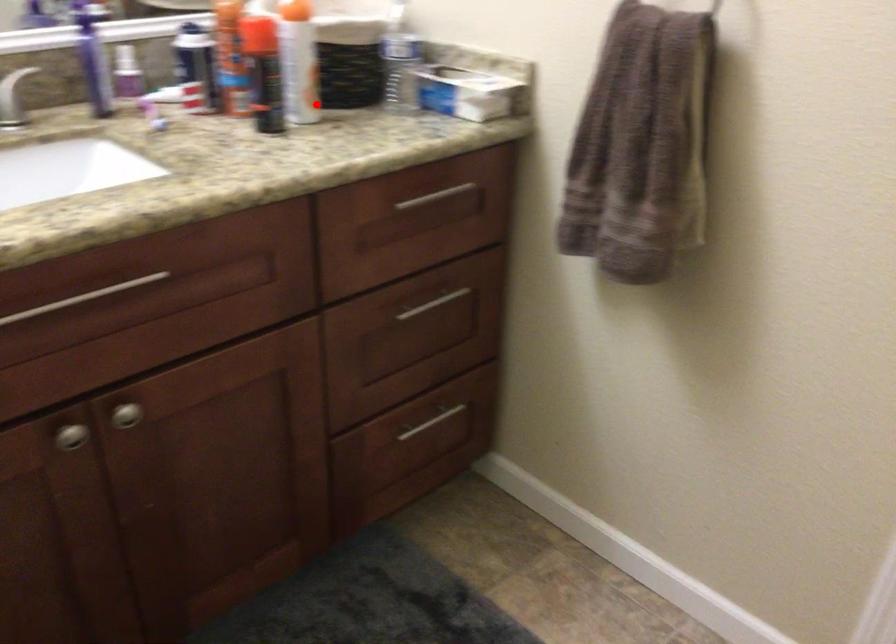
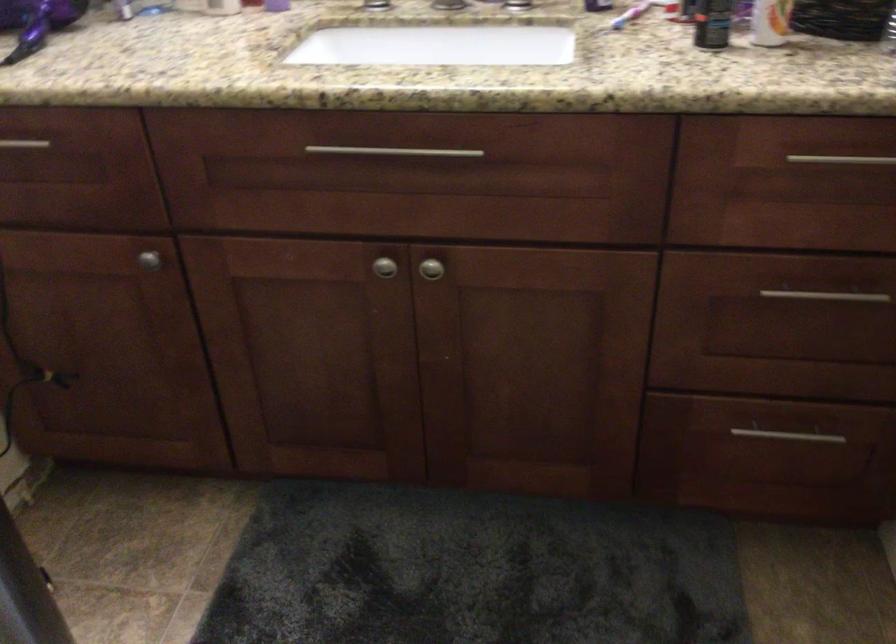
In the second image, find the point that corresponds to the highlighted location in the first image.

(770, 22)